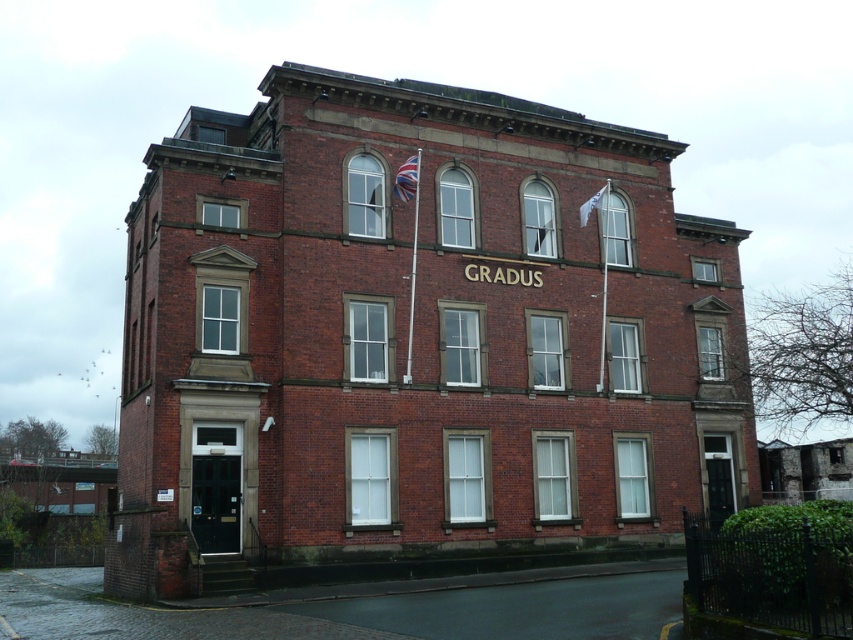
Question: Among these objects, which one is farthest from the camera?

Choices:
 (A) white fabric flag at upper right
 (B) union jack fabric flag at upper center

Answer: (A)

Question: Which of the following is the farthest from the observer?

Choices:
 (A) (585, 214)
 (B) (396, 189)

Answer: (A)

Question: Which object is closer to the camera taking this photo?

Choices:
 (A) white fabric flag at upper right
 (B) union jack fabric flag at upper center

Answer: (B)

Question: Does union jack fabric flag at upper center lie in front of white fabric flag at upper right?

Choices:
 (A) yes
 (B) no

Answer: (A)

Question: Is union jack fabric flag at upper center above white fabric flag at upper right?

Choices:
 (A) no
 (B) yes

Answer: (B)

Question: Does union jack fabric flag at upper center have a greater width compared to white fabric flag at upper right?

Choices:
 (A) no
 (B) yes

Answer: (B)